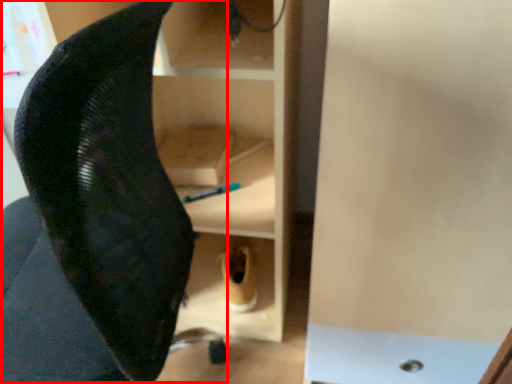
Question: Where is swivel chair (annotated by the red box) located in relation to footwear in the image?

Choices:
 (A) left
 (B) right

Answer: (A)